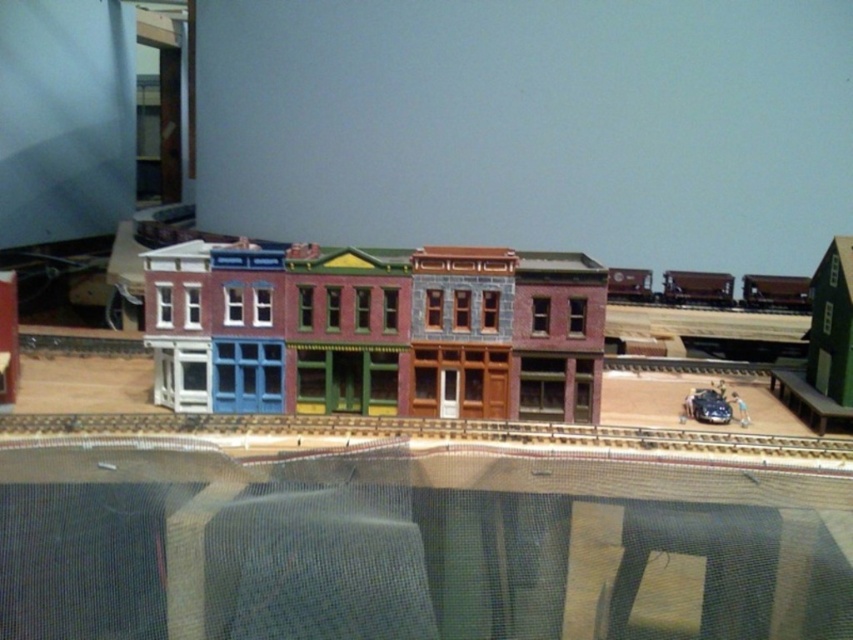
Between brown matte train car at center and shiny silver train car at center, which one is positioned lower?

shiny silver train car at center is below.

Can you confirm if brown matte train car at center is positioned above shiny silver train car at center?

Indeed, brown matte train car at center is positioned over shiny silver train car at center.

Between point (746, 275) and point (704, 413), which one is positioned behind?

Positioned behind is point (746, 275).

The height and width of the screenshot is (640, 853). Identify the location of brown matte train car at center. (711, 289).

Can you confirm if multicolored painted building at center is wider than metallic silver train track at center?

No, multicolored painted building at center is not wider than metallic silver train track at center.

Where is `multicolored painted building at center`? multicolored painted building at center is located at coordinates (375, 330).

Is point (309, 349) positioned after point (705, 394)?

No, (309, 349) is closer to viewer.

Can you confirm if multicolored painted building at center is thinner than shiny silver train car at center?

No, multicolored painted building at center is not thinner than shiny silver train car at center.

Is point (297, 305) closer to viewer compared to point (698, 417)?

No.

Identify the location of multicolored painted building at center. (375, 330).